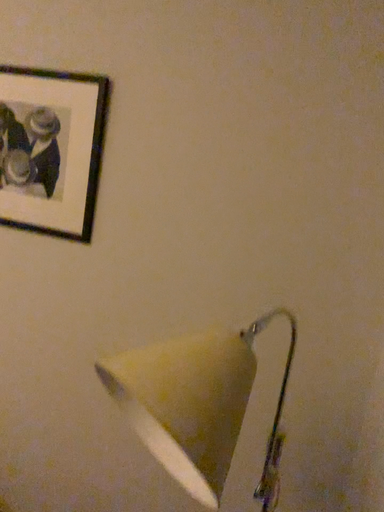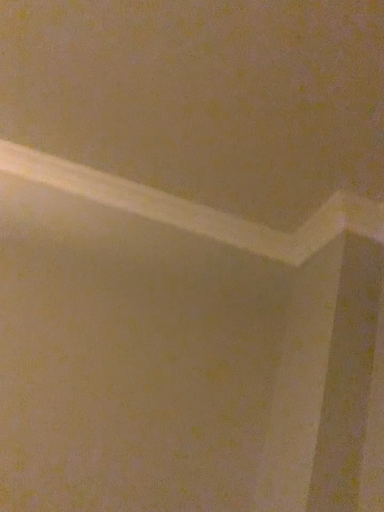
Question: Which way did the camera rotate in the video?

Choices:
 (A) rotated left
 (B) rotated right

Answer: (B)